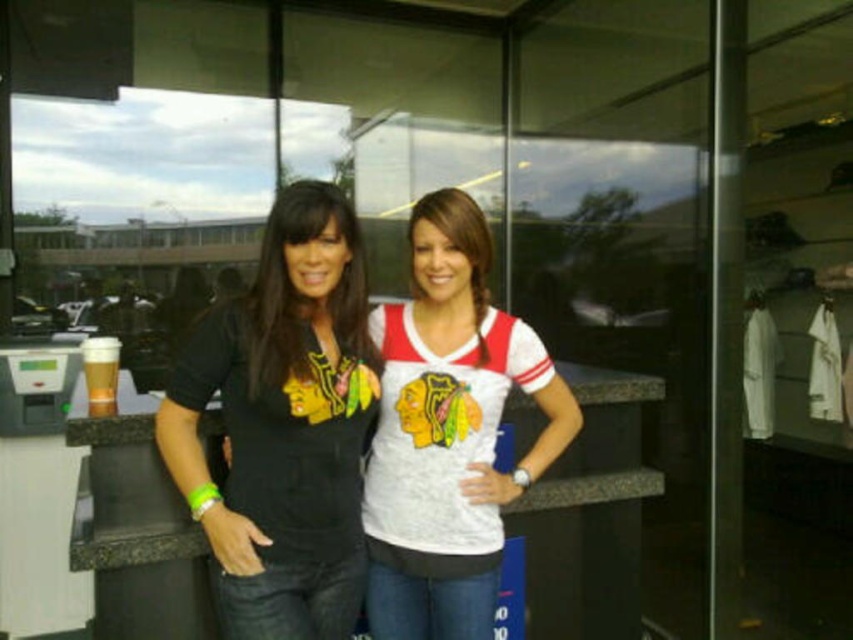
Who is higher up, black matte t-shirt at center or white jersey at center?

Positioned higher is black matte t-shirt at center.

Who is more distant from viewer, (316, 484) or (498, 499)?

The point (498, 499) is behind.

Locate an element on the screen. This screenshot has width=853, height=640. black matte t-shirt at center is located at coordinates (283, 424).